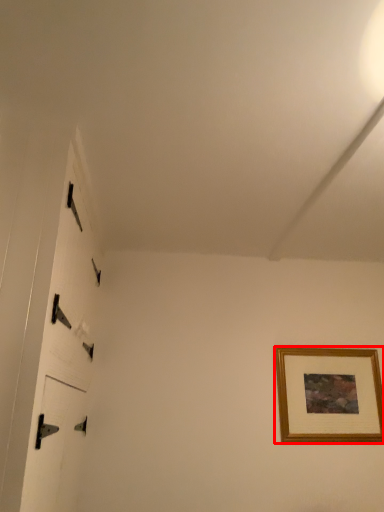
Question: From the image's perspective, what is the correct spatial relationship of picture frame (annotated by the red box) in relation to door?

Choices:
 (A) above
 (B) below

Answer: (B)